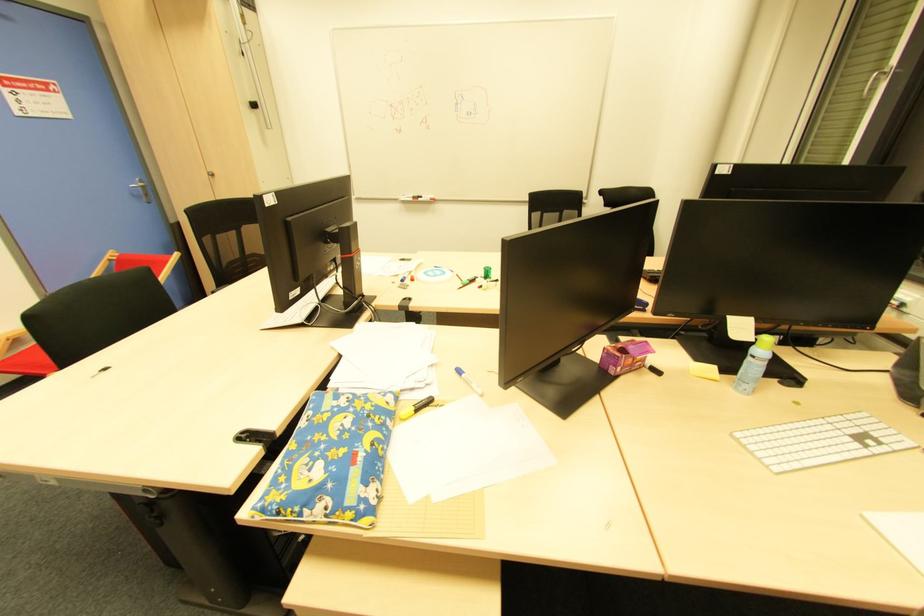
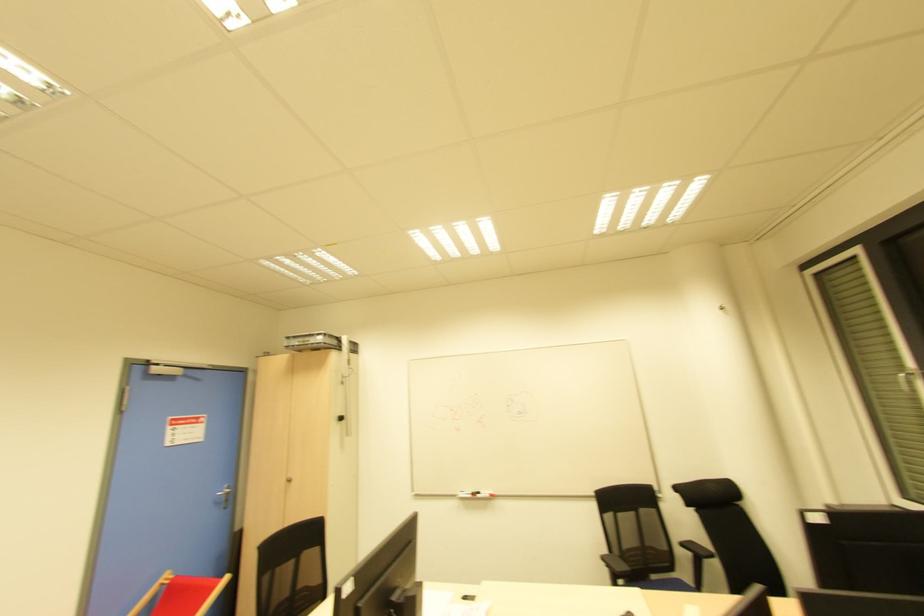
In the second image, find the point that corresponds to the point at 433,201 in the first image.

(492, 496)